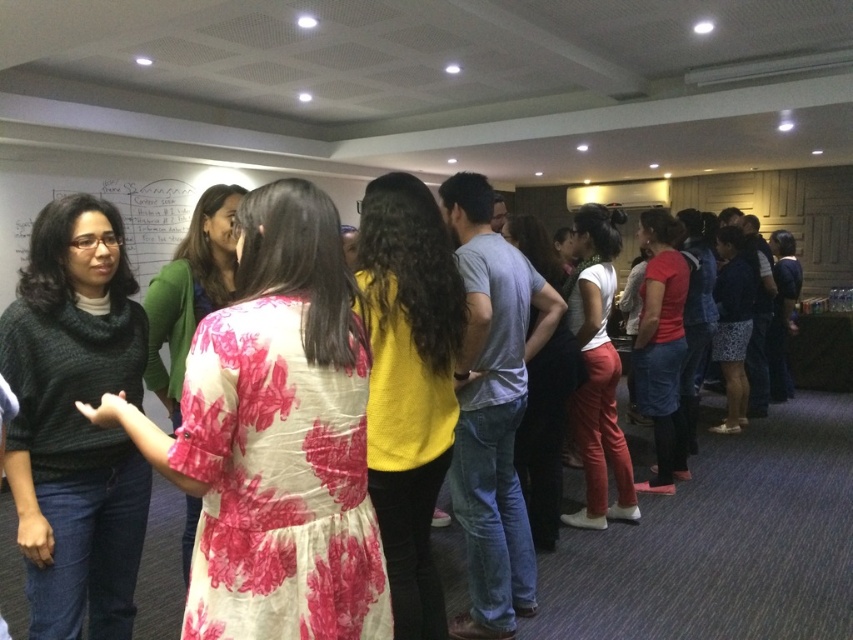
Question: Among these points, which one is farthest from the camera?

Choices:
 (A) (24, 323)
 (B) (397, 484)
 (C) (544, 529)
 (D) (328, 596)

Answer: (C)

Question: Based on their relative distances, which object is nearer to the floral fabric dress at center?

Choices:
 (A) knitted dark green sweater at left
 (B) floral cotton dress at center
 (C) matte red shirt at center

Answer: (A)

Question: Is white matte pants at center bigger than floral fabric dress at center?

Choices:
 (A) yes
 (B) no

Answer: (A)

Question: Which of the following is the farthest from the observer?

Choices:
 (A) matte yellow shirt at center
 (B) floral cotton dress at center
 (C) yellow matte sweater at center
 (D) white matte pants at center

Answer: (D)

Question: Can you confirm if white matte pants at center is positioned to the right of matte yellow shirt at center?

Choices:
 (A) yes
 (B) no

Answer: (A)

Question: Does floral cotton dress at center appear on the left side of matte red shirt at center?

Choices:
 (A) no
 (B) yes

Answer: (B)